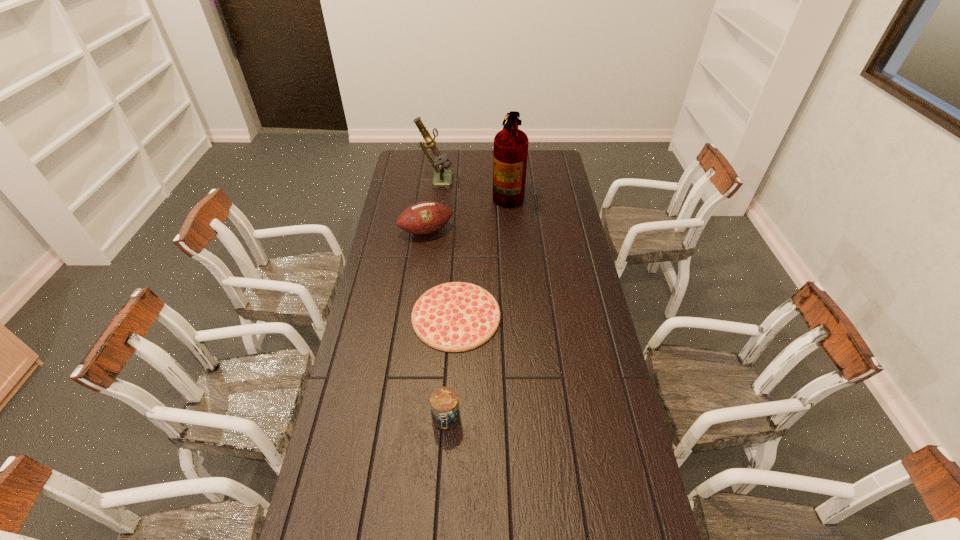
Where is `free location at the far edge of the desktop`? This screenshot has height=540, width=960. free location at the far edge of the desktop is located at coordinates (477, 168).

Identify the location of vacant region at the left edge of the desktop. The height and width of the screenshot is (540, 960). (372, 456).

The height and width of the screenshot is (540, 960). In order to click on free space at the right edge of the desktop in this screenshot , I will do `click(569, 337)`.

This screenshot has width=960, height=540. In order to click on vacant space that is in between the fourth farthest object and the microscope in this screenshot , I will do `click(446, 247)`.

I want to click on vacant space that is in between the fire extinguisher and the shortest object, so click(x=482, y=254).

In order to click on free area in between the third shortest object and the fire extinguisher in this screenshot , I will do `click(467, 212)`.

You are a GUI agent. You are given a task and a screenshot of the screen. Output one action in this format:
    pyautogui.click(x=<x>, y=<y>)
    Task: Click on the empty space between the third nearest object and the fourth farthest object
    The height and width of the screenshot is (540, 960).
    Given the screenshot: What is the action you would take?
    pyautogui.click(x=441, y=273)

At what (x,y) coordinates should I click in order to perform the action: click on vacant region between the fourth shortest object and the shortest object. Please return your answer as a coordinate pair (x, y). Looking at the image, I should click on (446, 247).

The image size is (960, 540). What are the coordinates of `empty space between the third nearest object and the pizza` in the screenshot? It's located at (441, 273).

You are a GUI agent. You are given a task and a screenshot of the screen. Output one action in this format:
    pyautogui.click(x=<x>, y=<y>)
    Task: Click on the object that can be found as the second closest to the tallest object
    
    Given the screenshot: What is the action you would take?
    pyautogui.click(x=442, y=178)